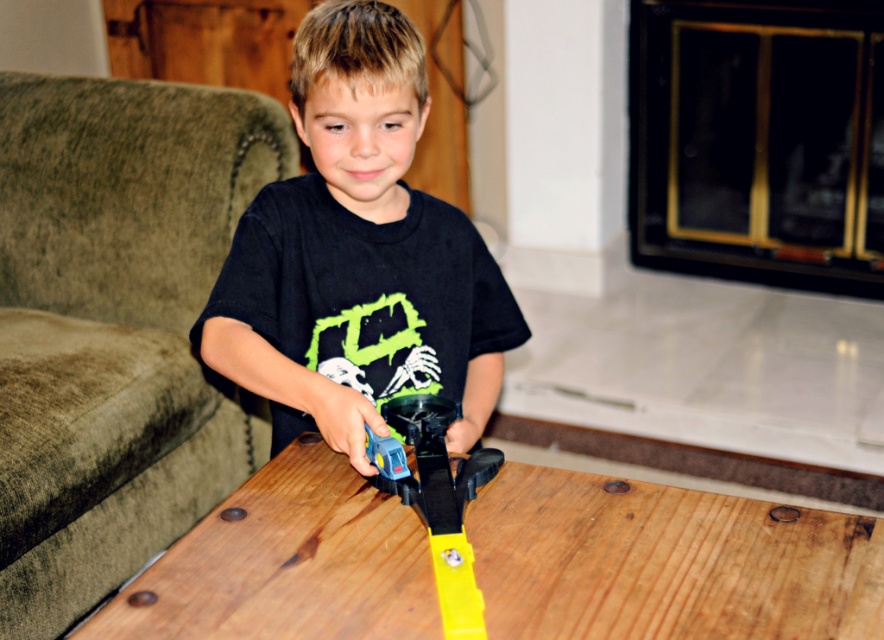
Who is lower down, black matte shirt at center or yellow plastic tool at center?

yellow plastic tool at center is lower down.

Between black matte shirt at center and yellow plastic tool at center, which one is positioned higher?

black matte shirt at center is above.

Between point (404, 355) and point (409, 413), which one is positioned behind?

Point (404, 355)

Find the location of a particular element. This screenshot has height=640, width=884. black matte shirt at center is located at coordinates (357, 256).

Measure the distance between wooden table at center and black matte shirt at center.

wooden table at center and black matte shirt at center are 27.27 centimeters apart from each other.

Is wooden table at center below black matte shirt at center?

Yes, wooden table at center is below black matte shirt at center.

Between point (406, 548) and point (469, 259), which one is positioned behind?

The point (469, 259) is behind.

I want to click on wooden table at center, so click(x=667, y=561).

Between point (24, 536) and point (291, 492), which one is positioned in front?

Point (291, 492) is more forward.

Is point (10, 304) behind point (217, 548)?

That is True.

Where is `velvet green couch at left`? velvet green couch at left is located at coordinates (113, 324).